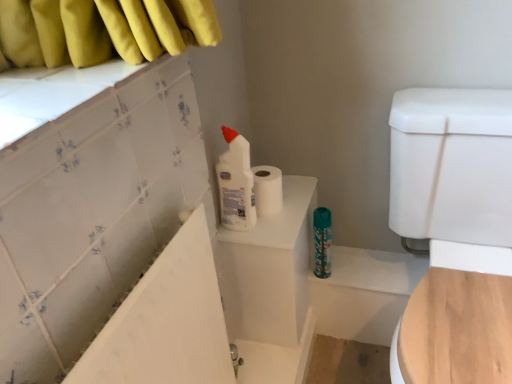
The width and height of the screenshot is (512, 384). What do you see at coordinates (267, 190) in the screenshot?
I see `white matte toilet paper at upper center` at bounding box center [267, 190].

Identify the location of white glossy toilet bowl at right. (455, 233).

In order to click on white matte toilet paper at upper center in this screenshot , I will do `click(267, 190)`.

Is white glossy toilet bowl at right surrounded by white glossy bathtub at upper left?

That's incorrect, white glossy toilet bowl at right is not inside white glossy bathtub at upper left.

Does white glossy bathtub at upper left have a larger size compared to white glossy toilet bowl at right?

No.

Does white glossy bathtub at upper left have a greater width compared to white glossy toilet bowl at right?

In fact, white glossy bathtub at upper left might be narrower than white glossy toilet bowl at right.

From the image's perspective, is white glossy bathtub at upper left located above or below white glossy toilet bowl at right?

white glossy bathtub at upper left is below white glossy toilet bowl at right.

Choose the correct answer: Is white plastic bottle at upper center inside white glossy toilet bowl at right or outside it?

white plastic bottle at upper center is spatially situated outside white glossy toilet bowl at right.

In terms of width, does white plastic bottle at upper center look wider or thinner when compared to white glossy toilet bowl at right?

white plastic bottle at upper center is thinner than white glossy toilet bowl at right.

Considering the relative sizes of white plastic bottle at upper center and white glossy toilet bowl at right in the image provided, is white plastic bottle at upper center shorter than white glossy toilet bowl at right?

Yes, white plastic bottle at upper center is shorter than white glossy toilet bowl at right.

Does white glossy toilet bowl at right come in front of white matte toilet paper at upper center?

Yes, white glossy toilet bowl at right is in front of white matte toilet paper at upper center.

Between white glossy toilet bowl at right and white matte toilet paper at upper center, which one has smaller width?

white matte toilet paper at upper center.

From the image's perspective, is white glossy toilet bowl at right on top of white matte toilet paper at upper center?

No.

Locate an element on the screen. toilet bowl in front of the white matte toilet paper at upper center is located at coordinates point(455,233).

From a real-world perspective, is white glossy bathtub at upper left below white matte toilet paper at upper center?

Indeed, from a real-world perspective, white glossy bathtub at upper left is positioned beneath white matte toilet paper at upper center.

Which of these two, white glossy bathtub at upper left or white matte toilet paper at upper center, stands taller?

With more height is white glossy bathtub at upper left.

Which object is wider, white glossy bathtub at upper left or white matte toilet paper at upper center?

white matte toilet paper at upper center is wider.

How different are the orientations of white glossy bathtub at upper left and white matte toilet paper at upper center in degrees?

They differ by 0.415 degrees in their facing directions.

Which is behind, point (202, 350) or point (237, 206)?

The point (237, 206) is farther.

Is white plastic bottle at upper center completely or partially inside white glossy bathtub at upper left?

No, white plastic bottle at upper center is not surrounded by white glossy bathtub at upper left.

Is white glossy toilet bowl at right far away from white plastic bottle at upper center?

No, there isn't a large distance between white glossy toilet bowl at right and white plastic bottle at upper center.

Is white glossy toilet bowl at right looking in the opposite direction of white plastic bottle at upper center?

white glossy toilet bowl at right is not turned away from white plastic bottle at upper center.

Between point (450, 149) and point (239, 145), which one is positioned in front?

The point (239, 145) is more forward.

Considering the sizes of objects white glossy toilet bowl at right and white plastic bottle at upper center in the image provided, who is smaller, white glossy toilet bowl at right or white plastic bottle at upper center?

white plastic bottle at upper center is smaller.

Are white plastic bottle at upper center and teal glossy water bottle at center far apart?

They are positioned close to each other.

Which is less distant, (230, 152) or (315, 270)?

Positioned in front is point (230, 152).

From the image's perspective, who appears lower, white plastic bottle at upper center or teal glossy water bottle at center?

teal glossy water bottle at center.

You are a GUI agent. You are given a task and a screenshot of the screen. Output one action in this format:
    pyautogui.click(x=<x>, y=<y>)
    Task: Click on the toilet bowl directly beneath the white glossy bathtub at upper left (from a real-world perspective)
    
    Given the screenshot: What is the action you would take?
    pyautogui.click(x=455, y=233)

Where is `toilet bowl that appears on the right of white plastic bottle at upper center`? Image resolution: width=512 pixels, height=384 pixels. toilet bowl that appears on the right of white plastic bottle at upper center is located at coordinates (455, 233).

Estimate the real-world distances between objects in this image. Which object is further from white matte toilet paper at upper center, white plastic bottle at upper center or teal glossy water bottle at center?

The object further to white matte toilet paper at upper center is teal glossy water bottle at center.

From the image, which object appears to be farther from white glossy bathtub at upper left, teal glossy water bottle at center or white plastic bottle at upper center?

teal glossy water bottle at center.

Based on their spatial positions, is white plastic bottle at upper center or white matte toilet paper at upper center further from teal glossy water bottle at center?

The object further to teal glossy water bottle at center is white plastic bottle at upper center.

Consider the image. Based on their spatial positions, is teal glossy water bottle at center or white plastic bottle at upper center closer to white matte toilet paper at upper center?

The object closer to white matte toilet paper at upper center is white plastic bottle at upper center.

Considering their positions, is white matte toilet paper at upper center positioned closer to white plastic bottle at upper center than white glossy bathtub at upper left?

white matte toilet paper at upper center lies closer to white plastic bottle at upper center than the other object.

Based on their spatial positions, is white glossy toilet bowl at right or white matte toilet paper at upper center further from white glossy bathtub at upper left?

white glossy toilet bowl at right.

When comparing their distances from white glossy bathtub at upper left, does white glossy toilet bowl at right or teal glossy water bottle at center seem further?

teal glossy water bottle at center lies further to white glossy bathtub at upper left than the other object.

Considering their positions, is white glossy toilet bowl at right positioned further to white plastic bottle at upper center than white glossy bathtub at upper left?

A: white glossy toilet bowl at right lies further to white plastic bottle at upper center than the other object.

I want to click on cleaning product situated between white glossy bathtub at upper left and white glossy toilet bowl at right from left to right, so click(236, 183).

The height and width of the screenshot is (384, 512). What are the coordinates of `toilet paper positioned between white glossy toilet bowl at right and teal glossy water bottle at center from near to far` in the screenshot? It's located at (267, 190).

At what (x,y) coordinates should I click in order to perform the action: click on toilet paper between white glossy bathtub at upper left and teal glossy water bottle at center from front to back. Please return your answer as a coordinate pair (x, y). The image size is (512, 384). Looking at the image, I should click on (267, 190).

Identify the location of cleaning product between white glossy bathtub at upper left and white matte toilet paper at upper center along the z-axis. (236, 183).